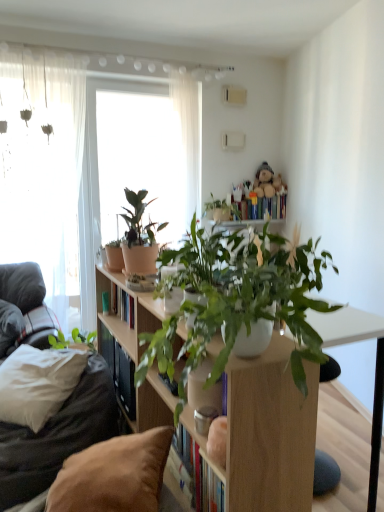
Question: Is point (256, 214) positioned closer to the camera than point (1, 302)?

Choices:
 (A) closer
 (B) farther

Answer: (B)

Question: From the image's perspective, is hardcover books at upper center located above or below white soft pillow at left, the 1th pillow from the back?

Choices:
 (A) below
 (B) above

Answer: (B)

Question: Estimate the real-world distances between objects in this image. Which object is closer to the green glossy plant at center, which is the 1th houseplant in front-to-back order?

Choices:
 (A) transparent glass window at center, the first window viewed from the right
 (B) matte terracotta pot at upper left, placed as the 2th houseplant when sorted from front to back
 (C) white soft pillow at left, which appears as the 1th pillow when viewed from the left
 (D) brown fabric pillow at lower left, the 2th pillow in the top-to-bottom sequence
 (E) fluffy beige teddy bear at upper center

Answer: (B)

Question: Which is farther from the fluffy beige teddy bear at upper center?

Choices:
 (A) brown fabric couch at left
 (B) translucent fabric at left, which is the second window from right to left
 (C) brown fabric pillow at lower left, the 1th pillow positioned from the right
 (D) green glossy plant at center, the 2th houseplant in the back-to-front sequence
 (E) transparent glass window at center, the second window in the left-to-right sequence

Answer: (C)